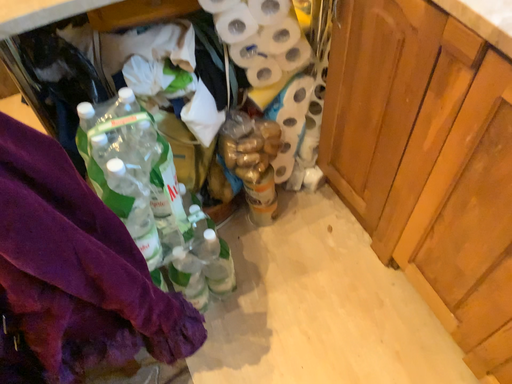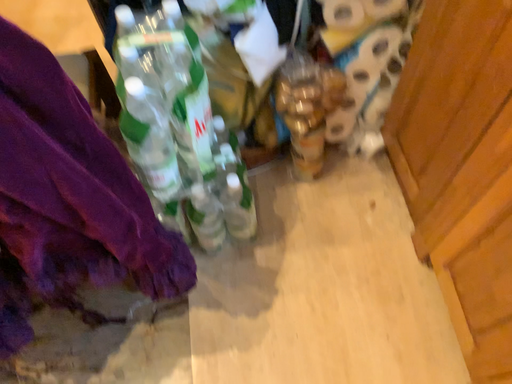
Question: How did the camera likely rotate when shooting the video?

Choices:
 (A) rotated upward
 (B) rotated downward

Answer: (B)